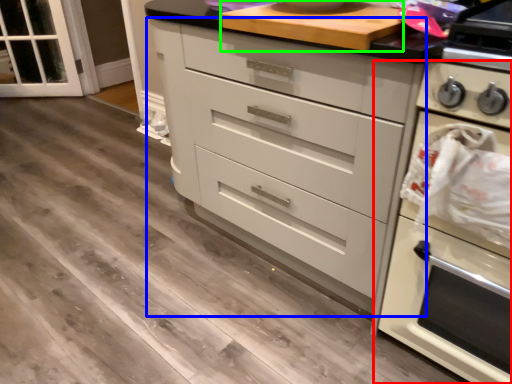
Question: Which is farther away from home appliance (highlighted by a red box)? chest of drawers (highlighted by a blue box) or appliance (highlighted by a green box)?

Choices:
 (A) chest of drawers
 (B) appliance

Answer: (B)